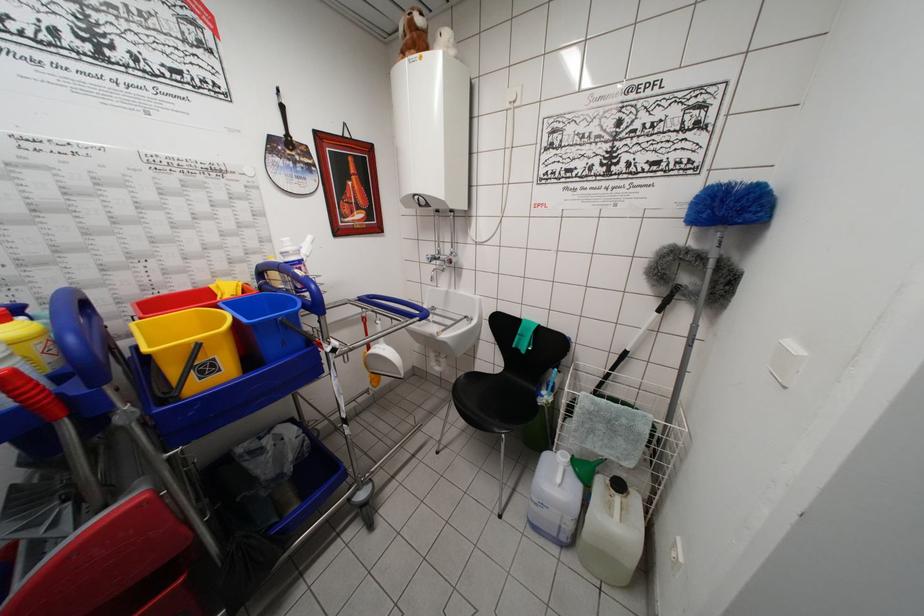
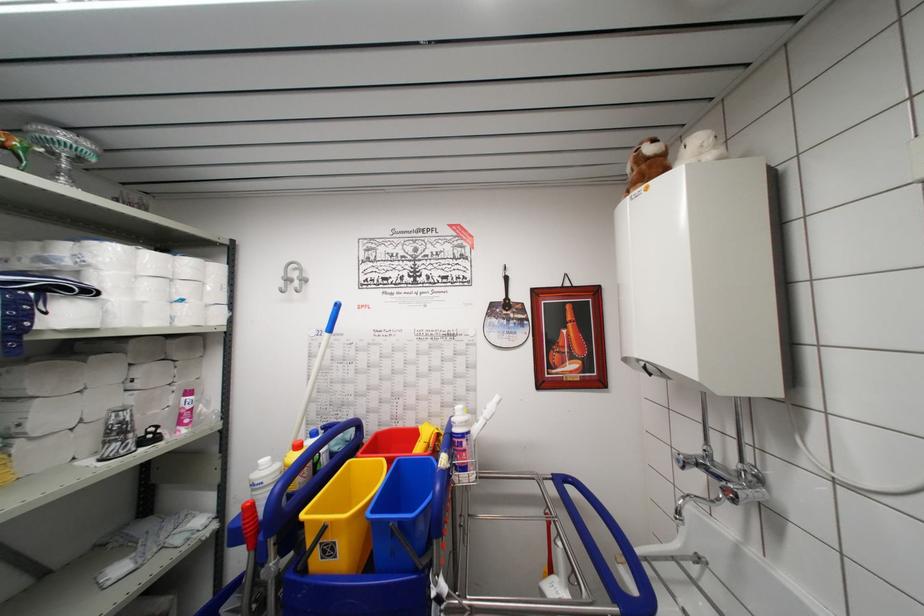
Find the pixel in the second image that matches point (295, 152) in the first image.

(511, 313)